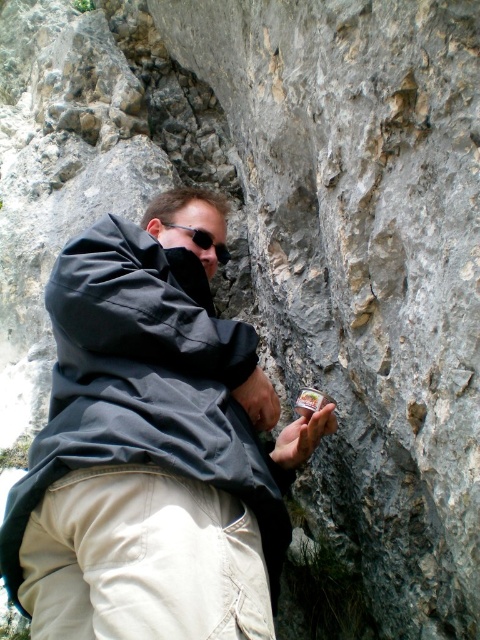
Question: Where is khaki cotton pants at lower left located in relation to black matte sunglasses at center in the image?

Choices:
 (A) right
 (B) left

Answer: (B)

Question: Is khaki cotton pants at lower left to the left of black matte sunglasses at center from the viewer's perspective?

Choices:
 (A) no
 (B) yes

Answer: (B)

Question: In this image, where is dark gray fabric at center located relative to black matte sunglasses at center?

Choices:
 (A) right
 (B) left

Answer: (B)

Question: Estimate the real-world distances between objects in this image. Which object is closer to the khaki cotton pants at lower left?

Choices:
 (A) black matte sunglasses at center
 (B) dark gray fabric at center

Answer: (B)

Question: Which point is farther from the camera taking this photo?

Choices:
 (A) (226, 522)
 (B) (253, 433)
 (C) (219, 248)

Answer: (C)

Question: Which object is closer to the camera taking this photo?

Choices:
 (A) black matte sunglasses at center
 (B) dark gray fabric at center
 (C) khaki cotton pants at lower left

Answer: (C)